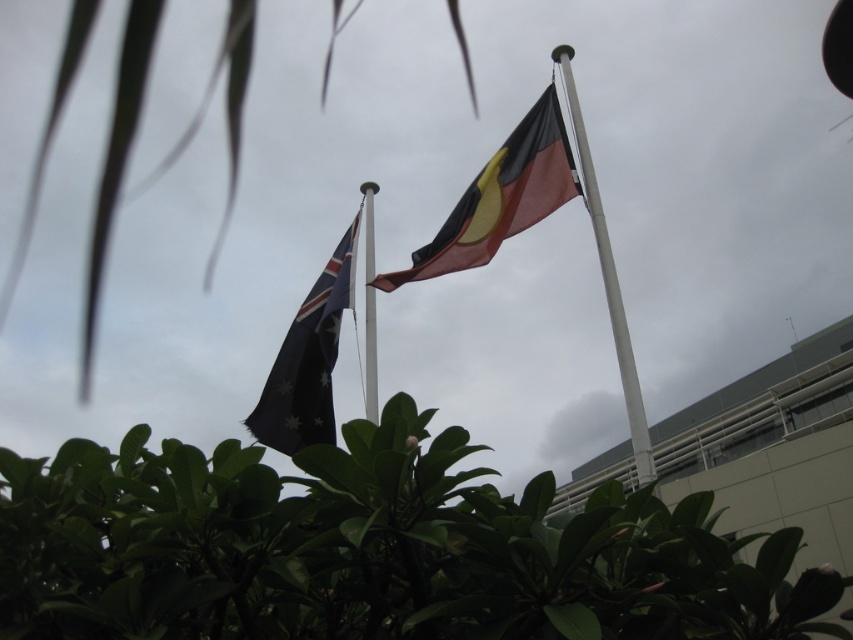
Is point (171, 490) farther from viewer compared to point (582, 179)?

No.

Who is more forward, (682, 536) or (624, 358)?

Point (682, 536) is more forward.

Where is `green leafy plant at lower center`? This screenshot has width=853, height=640. green leafy plant at lower center is located at coordinates (370, 550).

What do you see at coordinates (115, 161) in the screenshot? I see `green leafy plant at center` at bounding box center [115, 161].

Can you confirm if green leafy plant at center is positioned to the left of silver metallic pole at center?

Yes, green leafy plant at center is to the left of silver metallic pole at center.

Where is `green leafy plant at center`? The height and width of the screenshot is (640, 853). green leafy plant at center is located at coordinates pyautogui.click(x=115, y=161).

At what (x,y) coordinates should I click in order to perform the action: click on green leafy plant at center. Please return your answer as a coordinate pair (x, y). Looking at the image, I should click on (115, 161).

Is the position of dark blue fabric flag at center less distant than that of metallic flagpole at center?

No.

Is dark blue fabric flag at center bigger than metallic flagpole at center?

No, dark blue fabric flag at center is not bigger than metallic flagpole at center.

From the picture: Measure the distance between dark blue fabric flag at center and camera.

dark blue fabric flag at center is 60.28 feet away from camera.

You are a GUI agent. You are given a task and a screenshot of the screen. Output one action in this format:
    pyautogui.click(x=<x>, y=<y>)
    Task: Click on the dark blue fabric flag at center
    
    Given the screenshot: What is the action you would take?
    pyautogui.click(x=308, y=358)